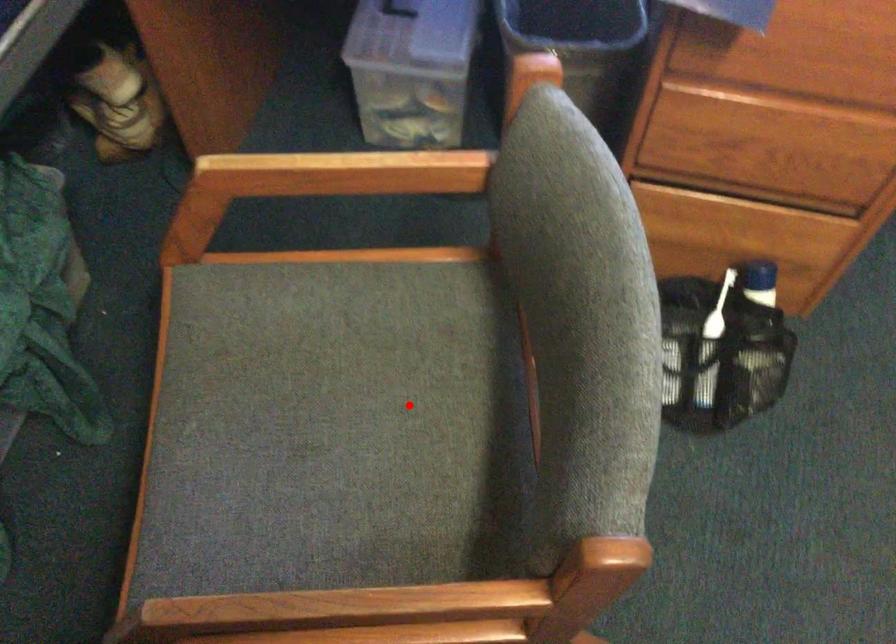
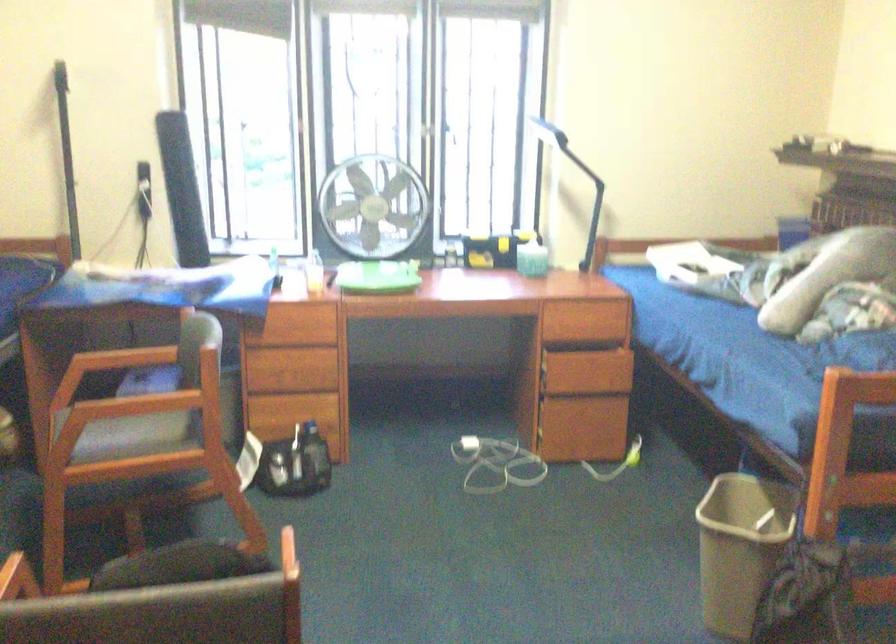
Locate, in the second image, the point that corresponds to the highlighted location in the first image.

(156, 427)